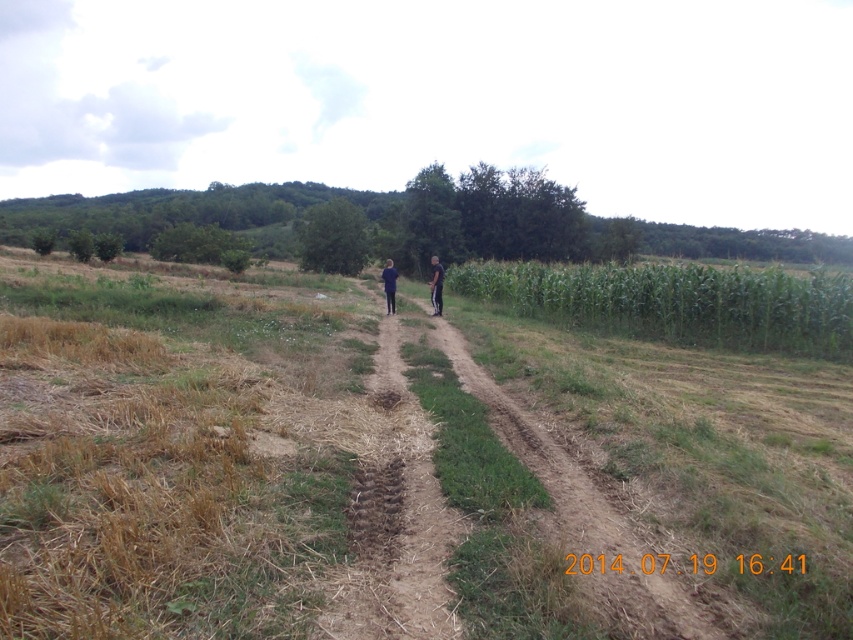
Does green leafy corn at right have a smaller size compared to brown dirt trail at center?

Actually, green leafy corn at right might be larger than brown dirt trail at center.

Is green leafy corn at right positioned at the back of brown dirt trail at center?

That is True.

Which is behind, point (674, 339) or point (460, 532)?

The point (674, 339) is more distant.

Locate an element on the screen. This screenshot has width=853, height=640. green leafy corn at right is located at coordinates (675, 301).

Is point (662, 308) more distant than point (427, 284)?

No, it is not.

Between green leafy corn at right and blue fabric couple at center, which one is positioned lower?

green leafy corn at right is lower down.

Identify the location of green leafy corn at right. This screenshot has height=640, width=853. (675, 301).

Does green leafy corn at right have a greater width compared to green leafy hill at upper center?

No.

Is green leafy corn at right closer to the viewer compared to green leafy hill at upper center?

Yes, it is in front of green leafy hill at upper center.

Which is in front, point (757, 292) or point (138, 237)?

Positioned in front is point (757, 292).

Find the location of a particular element. Image resolution: width=853 pixels, height=640 pixels. green leafy corn at right is located at coordinates [x=675, y=301].